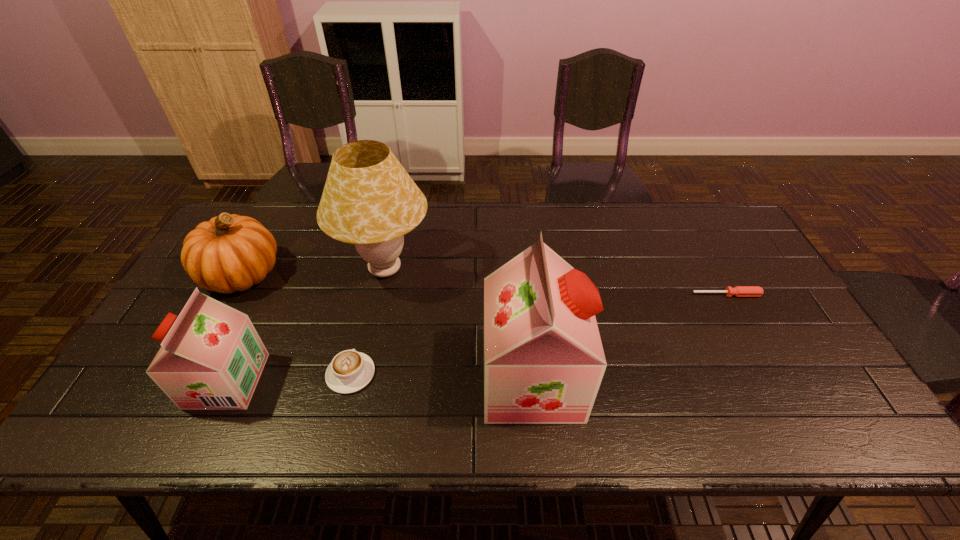
All soya milks are currently evenly spaced. To continue this pattern, where would you add another soya milk on the right? Please point out a vacant spot. Please provide its 2D coordinates. Your answer should be formatted as a tuple, i.e. [(x, y)], where the tuple contains the x and y coordinates of a point satisfying the conditions above.

[(834, 377)]